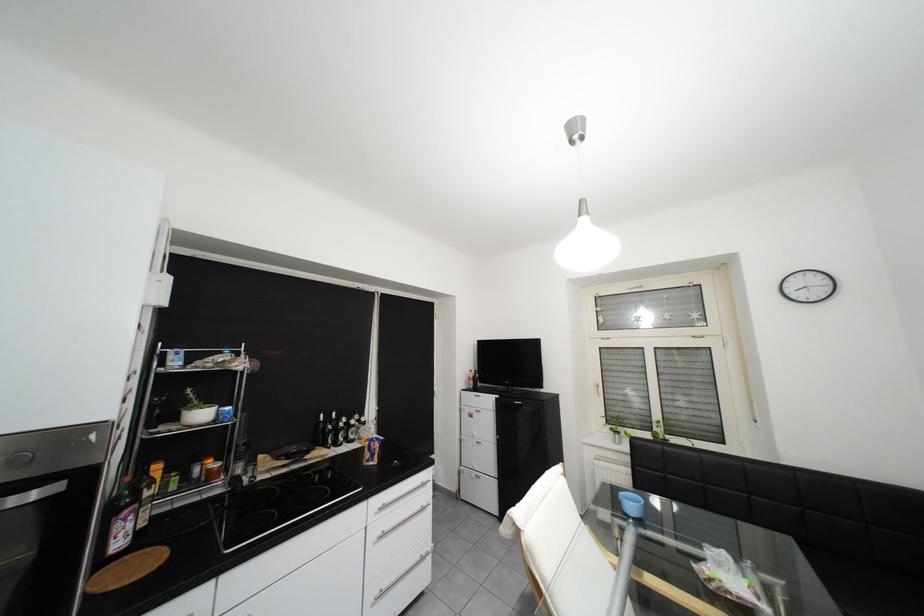
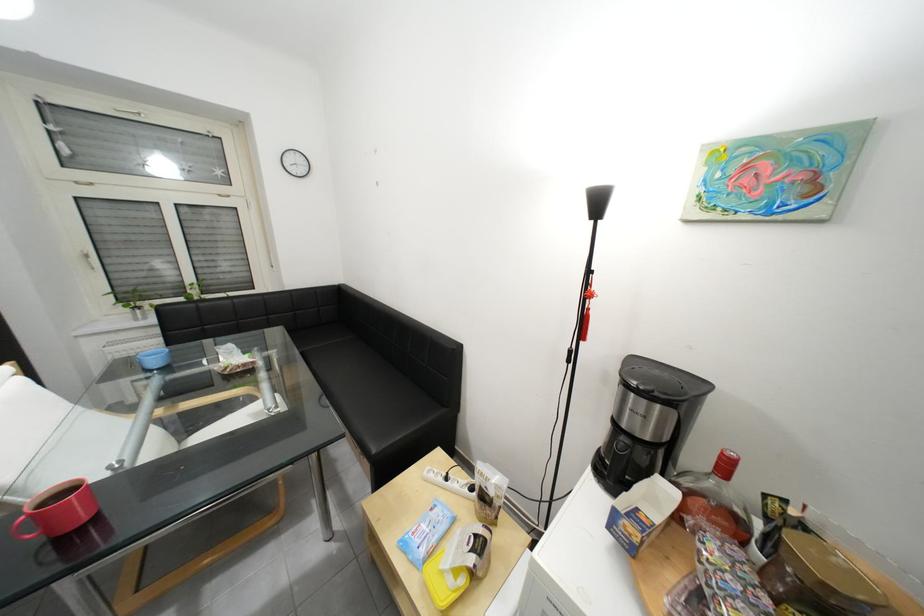
Find the pixel in the second image that matches pixel 642 507 in the first image.

(166, 363)